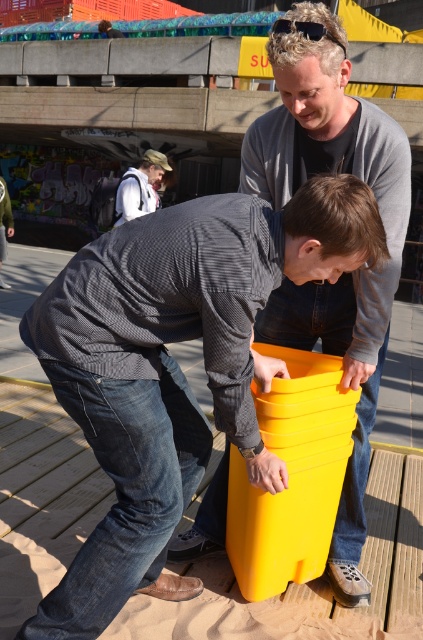
Question: Considering the relative positions of matte yellow bucket at center and matte yellow plastic bucket at center in the image provided, where is matte yellow bucket at center located with respect to matte yellow plastic bucket at center?

Choices:
 (A) right
 (B) left

Answer: (B)

Question: Which point is closer to the camera?

Choices:
 (A) (246, 200)
 (B) (140, 198)
 (C) (302, 340)

Answer: (A)

Question: Among these objects, which one is nearest to the camera?

Choices:
 (A) matte yellow bucket at center
 (B) matte yellow plastic bucket at center

Answer: (A)

Question: Where is matte yellow bucket at center located in relation to matte yellow plastic bucket at center in the image?

Choices:
 (A) right
 (B) left

Answer: (B)

Question: Observing the image, what is the correct spatial positioning of matte yellow plastic bucket at center in reference to white cotton shirt at upper left?

Choices:
 (A) below
 (B) above

Answer: (A)

Question: Which point appears closest to the camera in this image?

Choices:
 (A) (107, 620)
 (B) (340, 84)
 (C) (154, 179)

Answer: (A)